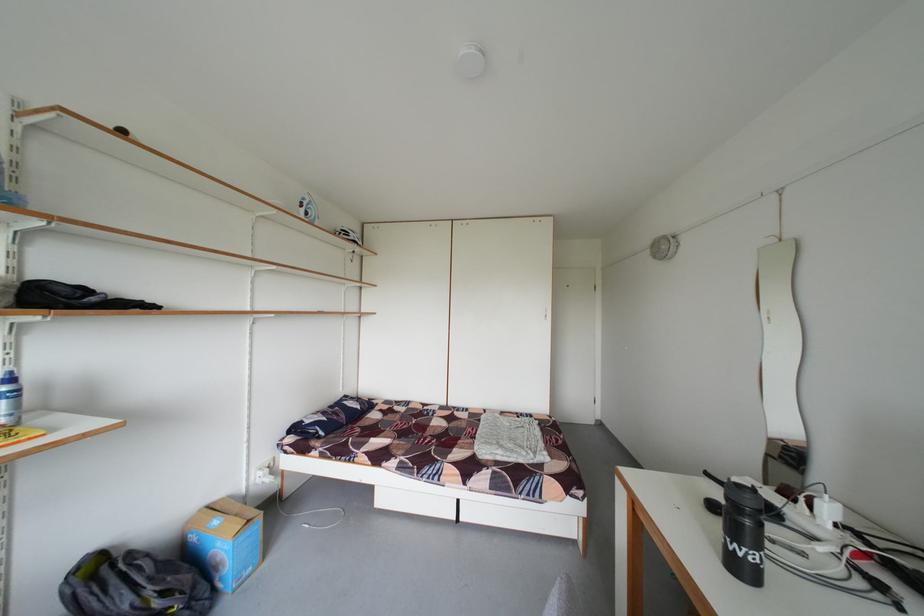
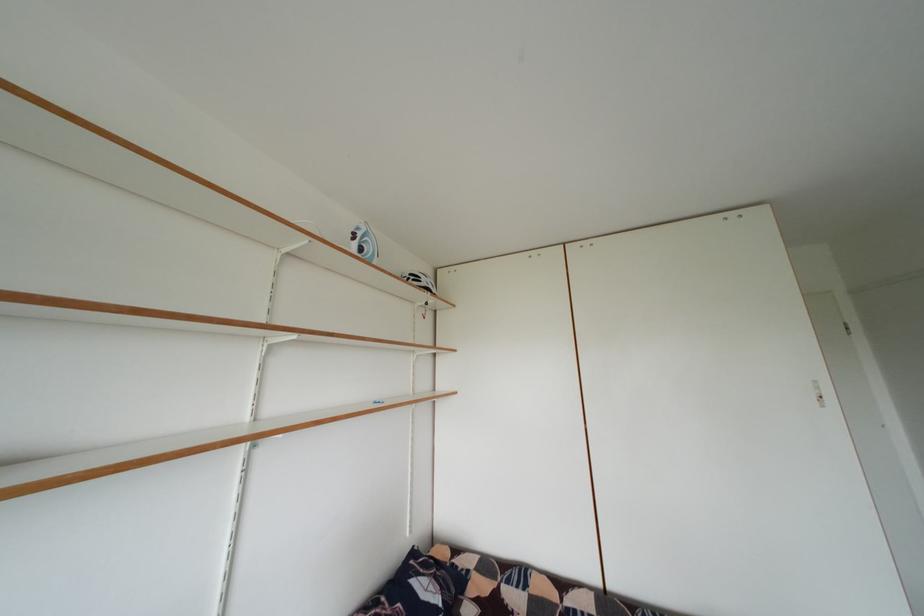
In a continuous first-person perspective shot, in which direction is the camera moving?

The cameraman moved toward left, forward.